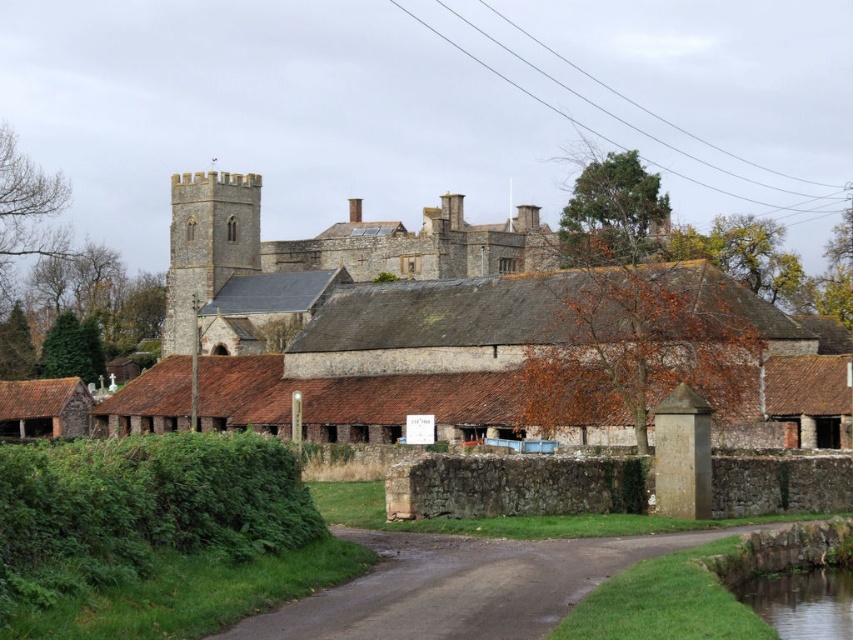
Question: From the image, what is the correct spatial relationship of brown stone castle at center in relation to damp asphalt road at center?

Choices:
 (A) above
 (B) below

Answer: (A)

Question: Which is farther from the brown stone castle at center?

Choices:
 (A) damp asphalt road at center
 (B) green grassy river at lower right
 (C) brown clay barns at center

Answer: (B)

Question: Which point is closer to the camera?

Choices:
 (A) (407, 545)
 (B) (811, 589)

Answer: (B)

Question: Can you confirm if brown clay barns at center is positioned to the right of brown stone castle at center?

Choices:
 (A) yes
 (B) no

Answer: (A)

Question: Can you confirm if brown clay barns at center is positioned above green grassy river at lower right?

Choices:
 (A) no
 (B) yes

Answer: (B)

Question: Which of the following is the farthest from the observer?

Choices:
 (A) damp asphalt road at center
 (B) brown clay barns at center

Answer: (B)